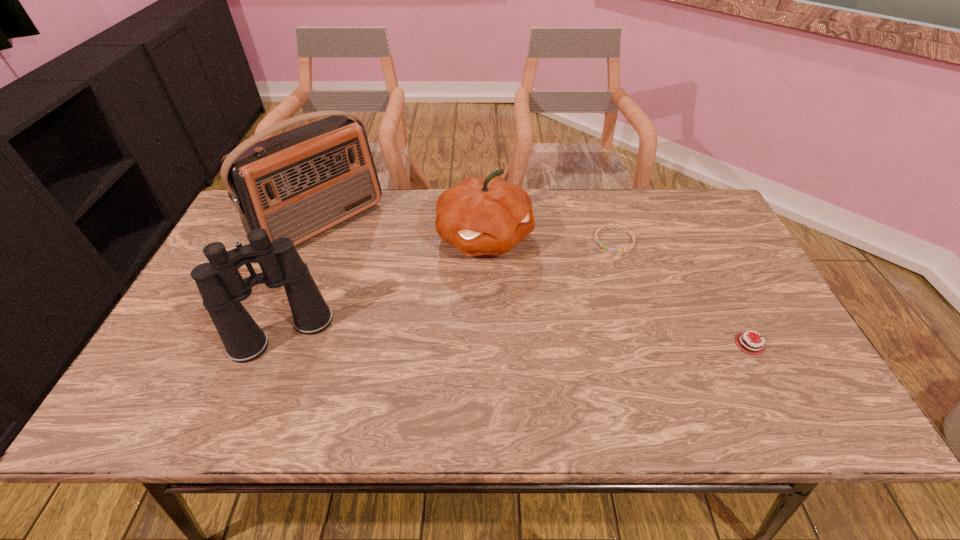
Where is `vacant space situated 0.150m on the front face of the third tallest object`? Image resolution: width=960 pixels, height=540 pixels. vacant space situated 0.150m on the front face of the third tallest object is located at coordinates (533, 305).

This screenshot has height=540, width=960. In order to click on vacant space situated 0.320m on the front face of the third tallest object in this screenshot , I will do `click(568, 355)`.

The image size is (960, 540). Find the location of `vacant space situated 0.290m on the front face of the third tallest object`. vacant space situated 0.290m on the front face of the third tallest object is located at coordinates pyautogui.click(x=562, y=346).

Where is `free location located 0.170m on the surface of the shortest object showing star-shaped elements`? This screenshot has height=540, width=960. free location located 0.170m on the surface of the shortest object showing star-shaped elements is located at coordinates (576, 285).

Find the location of a particular element. This screenshot has width=960, height=540. vacant area situated 0.340m on the surface of the shortest object showing star-shaped elements is located at coordinates (542, 324).

This screenshot has width=960, height=540. I want to click on vacant space situated 0.310m on the surface of the shortest object showing star-shaped elements, so click(548, 317).

What are the coordinates of `free spot located 0.050m on the front-facing side of the radio receiver` in the screenshot? It's located at (364, 259).

You are a GUI agent. You are given a task and a screenshot of the screen. Output one action in this format:
    pyautogui.click(x=<x>, y=<y>)
    Task: Click on the free region located on the front-facing side of the radio receiver
    
    Given the screenshot: What is the action you would take?
    pyautogui.click(x=443, y=327)

This screenshot has width=960, height=540. Identify the location of vacant space situated on the front-facing side of the radio receiver. tap(418, 305).

Identify the location of pumpkin positioned at the far edge. (479, 216).